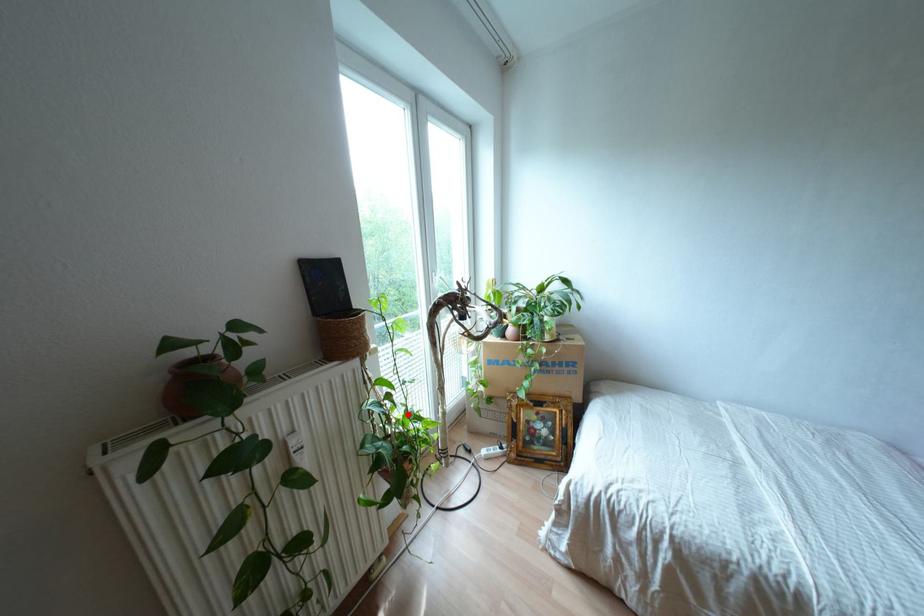
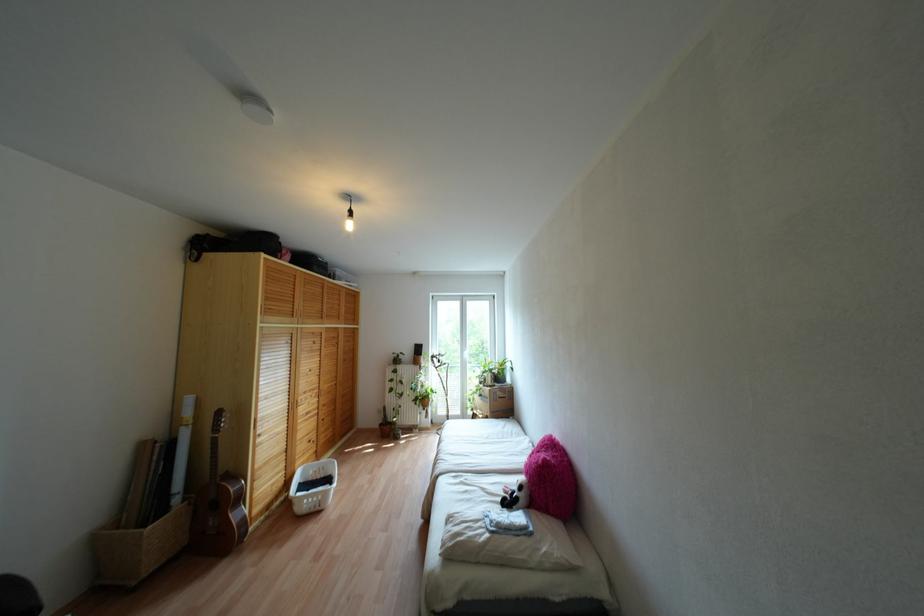
Question: A red point is marked in image1. In image2, is the corresponding 3D point closer to the camera or farther? Reply with the corresponding letter.

Choices:
 (A) The corresponding 3D point is closer.
 (B) The corresponding 3D point is farther.

Answer: (B)